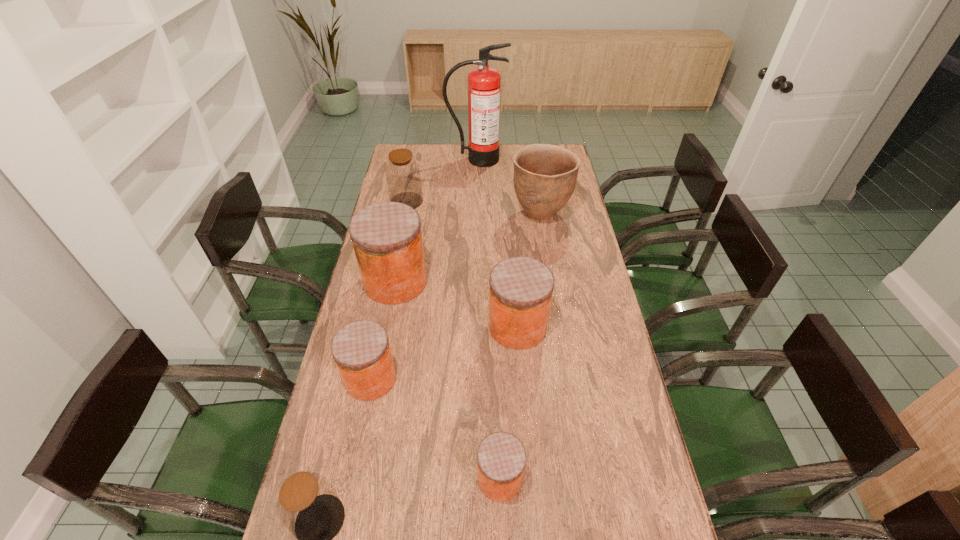
I want to click on red fire extinguisher, so click(484, 83).

Locate an element on the screen. the farthest object is located at coordinates (484, 83).

Image resolution: width=960 pixels, height=540 pixels. In order to click on pottery in this screenshot , I will do `click(545, 175)`.

Find the location of a particular element. the biggest orange jar is located at coordinates (387, 239).

This screenshot has height=540, width=960. In order to click on the second biggest orange jar in this screenshot , I will do `click(520, 293)`.

The width and height of the screenshot is (960, 540). Find the location of `the bigger brown jar`. the bigger brown jar is located at coordinates (403, 177).

In order to click on the farther brown jar in this screenshot , I will do `click(403, 177)`.

Find the location of a particular element. the third nearest jar is located at coordinates (361, 350).

Find the location of a particular element. the sixth farthest object is located at coordinates (361, 350).

Locate an element on the screen. The image size is (960, 540). the shortest object is located at coordinates (501, 457).